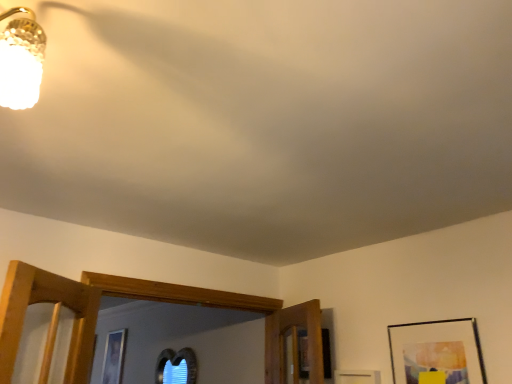
Question: Considering the relative sizes of smooth glass window at lower center and matte black picture frame at lower right in the image provided, is smooth glass window at lower center thinner than matte black picture frame at lower right?

Choices:
 (A) no
 (B) yes

Answer: (B)

Question: Is smooth glass window at lower center touching matte black picture frame at lower right?

Choices:
 (A) yes
 (B) no

Answer: (B)

Question: Can you confirm if smooth glass window at lower center is positioned to the right of matte black picture frame at lower right?

Choices:
 (A) no
 (B) yes

Answer: (A)

Question: Does smooth glass window at lower center have a larger size compared to matte black picture frame at lower right?

Choices:
 (A) yes
 (B) no

Answer: (A)

Question: Does smooth glass window at lower center turn towards matte black picture frame at lower right?

Choices:
 (A) no
 (B) yes

Answer: (A)

Question: From a real-world perspective, does smooth glass window at lower center sit lower than matte black picture frame at lower right?

Choices:
 (A) no
 (B) yes

Answer: (B)

Question: Can you confirm if matte black picture frame at lower right is positioned to the left of smooth glass window at lower center?

Choices:
 (A) yes
 (B) no

Answer: (B)

Question: Can you confirm if matte black picture frame at lower right is taller than smooth glass window at lower center?

Choices:
 (A) no
 (B) yes

Answer: (A)

Question: Is matte black picture frame at lower right at the right side of smooth glass window at lower center?

Choices:
 (A) yes
 (B) no

Answer: (A)

Question: From the image's perspective, would you say matte black picture frame at lower right is shown under smooth glass window at lower center?

Choices:
 (A) no
 (B) yes

Answer: (A)

Question: Is matte black picture frame at lower right not inside smooth glass window at lower center?

Choices:
 (A) no
 (B) yes

Answer: (B)

Question: Could you tell me if matte black picture frame at lower right is facing smooth glass window at lower center?

Choices:
 (A) yes
 (B) no

Answer: (B)

Question: From their relative heights in the image, would you say smooth glass window at lower center is taller or shorter than matte black picture frame at lower right?

Choices:
 (A) tall
 (B) short

Answer: (A)